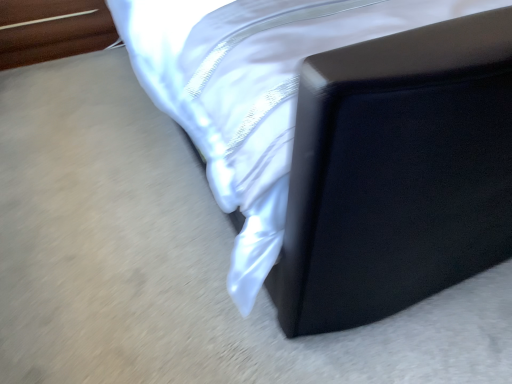
Consider the image. How much space does wooden toothpick at upper left, which ranks as the first furniture in left-to-right order, occupy horizontally?

wooden toothpick at upper left, which ranks as the first furniture in left-to-right order, is 25.53 inches wide.

What are the coordinates of `wooden toothpick at upper left, acting as the second furniture starting from the right` in the screenshot? It's located at (52, 30).

Describe the element at coordinates (52, 30) in the screenshot. I see `wooden toothpick at upper left, which ranks as the first furniture in left-to-right order` at that location.

At what (x,y) coordinates should I click in order to perform the action: click on matte black bed frame at upper right, acting as the second furniture starting from the left. Please return your answer as a coordinate pair (x, y). Looking at the image, I should click on (341, 142).

Image resolution: width=512 pixels, height=384 pixels. What do you see at coordinates (341, 142) in the screenshot?
I see `matte black bed frame at upper right, acting as the second furniture starting from the left` at bounding box center [341, 142].

Locate an element on the screen. The width and height of the screenshot is (512, 384). wooden toothpick at upper left, acting as the second furniture starting from the right is located at coordinates (52, 30).

Is matte black bed frame at upper right, the first furniture in the right-to-left sequence, to the left of wooden toothpick at upper left, which ranks as the first furniture in left-to-right order, from the viewer's perspective?

Incorrect, matte black bed frame at upper right, the first furniture in the right-to-left sequence, is not on the left side of wooden toothpick at upper left, which ranks as the first furniture in left-to-right order.

Considering the positions of objects matte black bed frame at upper right, acting as the second furniture starting from the left, and wooden toothpick at upper left, which ranks as the first furniture in left-to-right order, in the image provided, who is behind, matte black bed frame at upper right, acting as the second furniture starting from the left, or wooden toothpick at upper left, which ranks as the first furniture in left-to-right order,?

wooden toothpick at upper left, which ranks as the first furniture in left-to-right order, is more distant.

Which point is more distant from viewer, (482, 207) or (16, 56)?

The point (16, 56) is farther from the camera.

From the image's perspective, is matte black bed frame at upper right, acting as the second furniture starting from the left, below wooden toothpick at upper left, which ranks as the first furniture in left-to-right order?

No, from the image's perspective, matte black bed frame at upper right, acting as the second furniture starting from the left, is not below wooden toothpick at upper left, which ranks as the first furniture in left-to-right order.

From a real-world perspective, is matte black bed frame at upper right, the first furniture in the right-to-left sequence, on wooden toothpick at upper left, acting as the second furniture starting from the right?

Yes.

In the scene shown: Considering the sizes of objects matte black bed frame at upper right, acting as the second furniture starting from the left, and wooden toothpick at upper left, which ranks as the first furniture in left-to-right order, in the image provided, who is wider, matte black bed frame at upper right, acting as the second furniture starting from the left, or wooden toothpick at upper left, which ranks as the first furniture in left-to-right order,?

Wider between the two is matte black bed frame at upper right, acting as the second furniture starting from the left.

Between matte black bed frame at upper right, the first furniture in the right-to-left sequence, and wooden toothpick at upper left, which ranks as the first furniture in left-to-right order, which one has less height?

wooden toothpick at upper left, which ranks as the first furniture in left-to-right order, is shorter.

Looking at this image, based on their sizes in the image, would you say matte black bed frame at upper right, the first furniture in the right-to-left sequence, is bigger or smaller than wooden toothpick at upper left, which ranks as the first furniture in left-to-right order?

matte black bed frame at upper right, the first furniture in the right-to-left sequence, is bigger than wooden toothpick at upper left, which ranks as the first furniture in left-to-right order.

Is wooden toothpick at upper left, acting as the second furniture starting from the right, surrounded by matte black bed frame at upper right, acting as the second furniture starting from the left?

Actually, wooden toothpick at upper left, acting as the second furniture starting from the right, is outside matte black bed frame at upper right, acting as the second furniture starting from the left.

Are matte black bed frame at upper right, acting as the second furniture starting from the left, and wooden toothpick at upper left, acting as the second furniture starting from the right, beside each other?

They are not placed beside each other.

Is matte black bed frame at upper right, acting as the second furniture starting from the left, aimed at wooden toothpick at upper left, acting as the second furniture starting from the right?

No, matte black bed frame at upper right, acting as the second furniture starting from the left, is not aimed at wooden toothpick at upper left, acting as the second furniture starting from the right.

This screenshot has height=384, width=512. Identify the location of furniture above the wooden toothpick at upper left, which ranks as the first furniture in left-to-right order (from the image's perspective). (341, 142).

Is wooden toothpick at upper left, acting as the second furniture starting from the right, at the left side of matte black bed frame at upper right, the first furniture in the right-to-left sequence?

Yes.

Which object is further away from the camera taking this photo, wooden toothpick at upper left, acting as the second furniture starting from the right, or matte black bed frame at upper right, the first furniture in the right-to-left sequence?

wooden toothpick at upper left, acting as the second furniture starting from the right, is more distant.

Is point (84, 5) positioned before point (271, 94)?

No, it is not.

From the image's perspective, between wooden toothpick at upper left, acting as the second furniture starting from the right, and matte black bed frame at upper right, acting as the second furniture starting from the left, who is located below?

From the image's view, wooden toothpick at upper left, acting as the second furniture starting from the right, is below.

From a real-world perspective, which is physically below, wooden toothpick at upper left, acting as the second furniture starting from the right, or matte black bed frame at upper right, the first furniture in the right-to-left sequence?

wooden toothpick at upper left, acting as the second furniture starting from the right.

Between wooden toothpick at upper left, acting as the second furniture starting from the right, and matte black bed frame at upper right, acting as the second furniture starting from the left, which one has smaller width?

wooden toothpick at upper left, acting as the second furniture starting from the right, is thinner.

Considering the relative sizes of wooden toothpick at upper left, acting as the second furniture starting from the right, and matte black bed frame at upper right, the first furniture in the right-to-left sequence, in the image provided, is wooden toothpick at upper left, acting as the second furniture starting from the right, shorter than matte black bed frame at upper right, the first furniture in the right-to-left sequence,?

Indeed, wooden toothpick at upper left, acting as the second furniture starting from the right, has a lesser height compared to matte black bed frame at upper right, the first furniture in the right-to-left sequence.

In terms of size, does wooden toothpick at upper left, which ranks as the first furniture in left-to-right order, appear bigger or smaller than matte black bed frame at upper right, acting as the second furniture starting from the left?

wooden toothpick at upper left, which ranks as the first furniture in left-to-right order, is smaller than matte black bed frame at upper right, acting as the second furniture starting from the left.

Based on the photo, is wooden toothpick at upper left, which ranks as the first furniture in left-to-right order, not inside matte black bed frame at upper right, acting as the second furniture starting from the left?

Absolutely, wooden toothpick at upper left, which ranks as the first furniture in left-to-right order, is external to matte black bed frame at upper right, acting as the second furniture starting from the left.

Are wooden toothpick at upper left, acting as the second furniture starting from the right, and matte black bed frame at upper right, acting as the second furniture starting from the left, located far from each other?

Yes, wooden toothpick at upper left, acting as the second furniture starting from the right, is far from matte black bed frame at upper right, acting as the second furniture starting from the left.

Is wooden toothpick at upper left, acting as the second furniture starting from the right, positioned with its back to matte black bed frame at upper right, acting as the second furniture starting from the left?

wooden toothpick at upper left, acting as the second furniture starting from the right, is not turned away from matte black bed frame at upper right, acting as the second furniture starting from the left.

Can you tell me how much wooden toothpick at upper left, which ranks as the first furniture in left-to-right order, and matte black bed frame at upper right, the first furniture in the right-to-left sequence, differ in facing direction?

The angle between the facing direction of wooden toothpick at upper left, which ranks as the first furniture in left-to-right order, and the facing direction of matte black bed frame at upper right, the first furniture in the right-to-left sequence, is 0.000381 degrees.

At what (x,y) coordinates should I click in order to perform the action: click on furniture behind the matte black bed frame at upper right, the first furniture in the right-to-left sequence. Please return your answer as a coordinate pair (x, y). Looking at the image, I should click on (52, 30).

Find the location of `furniture located behind the matte black bed frame at upper right, acting as the second furniture starting from the left`. furniture located behind the matte black bed frame at upper right, acting as the second furniture starting from the left is located at coordinates (52, 30).

Find the location of a particular element. Image resolution: width=512 pixels, height=384 pixels. furniture on the right of wooden toothpick at upper left, acting as the second furniture starting from the right is located at coordinates (341, 142).